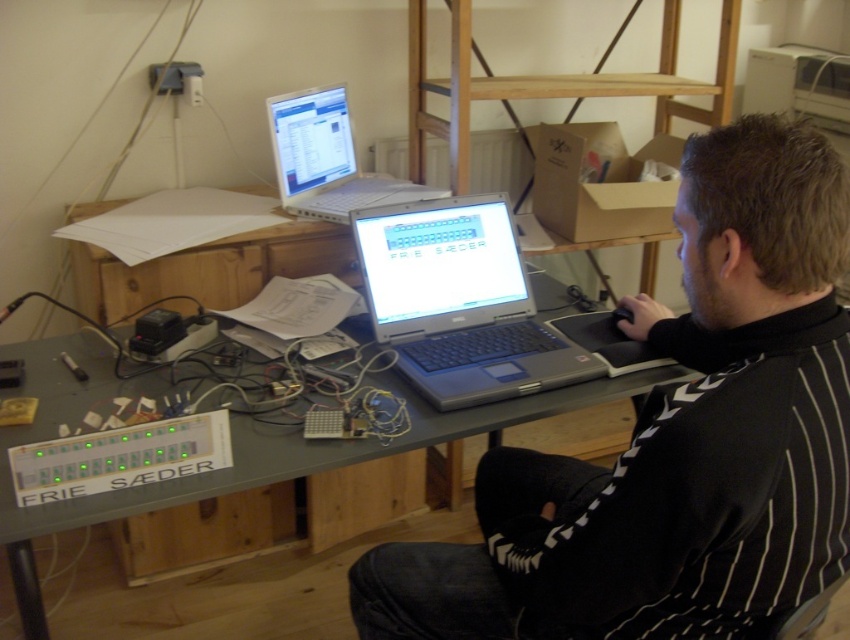
The width and height of the screenshot is (850, 640). Describe the element at coordinates (677, 440) in the screenshot. I see `black striped shirt at center` at that location.

Looking at this image, measure the distance between black striped shirt at center and camera.

The distance of black striped shirt at center from camera is 31.87 inches.

I want to click on black striped shirt at center, so click(x=677, y=440).

Where is `black striped shirt at center`? The image size is (850, 640). black striped shirt at center is located at coordinates (677, 440).

Which is more to the left, black striped shirt at center or silver/black plastic laptop at center?

silver/black plastic laptop at center

This screenshot has height=640, width=850. Describe the element at coordinates (677, 440) in the screenshot. I see `black striped shirt at center` at that location.

Locate an element on the screen. The height and width of the screenshot is (640, 850). black striped shirt at center is located at coordinates (677, 440).

Measure the distance between black striped shirt at center and camera.

black striped shirt at center and camera are 31.87 inches apart from each other.

Who is higher up, black striped shirt at center or gray plastic desk at center?

Positioned higher is black striped shirt at center.

Is point (786, 602) farther from viewer compared to point (552, 298)?

No, it is in front of (552, 298).

Locate an element on the screen. The image size is (850, 640). black striped shirt at center is located at coordinates (677, 440).